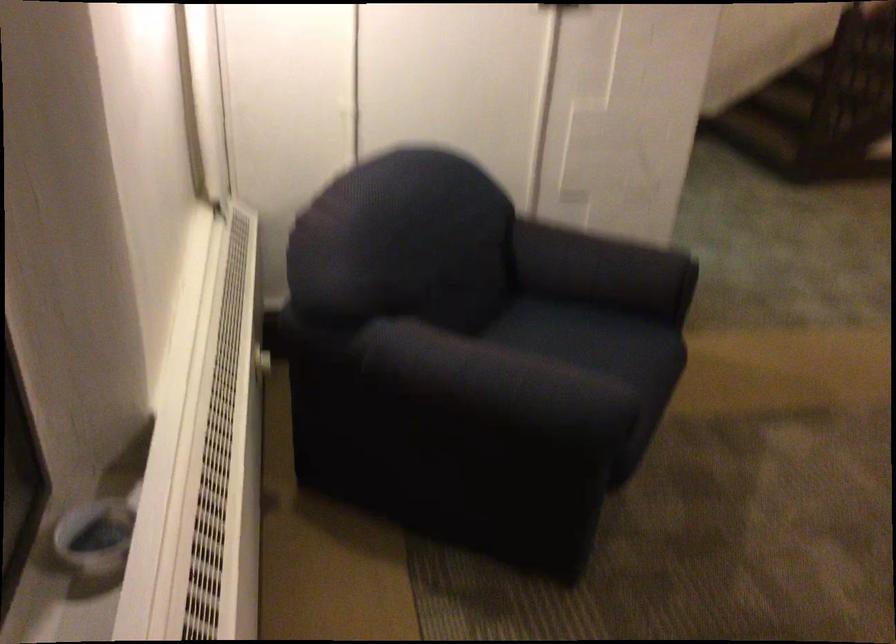
Where is `dark blue armrest`? The image size is (896, 644). dark blue armrest is located at coordinates (604, 270).